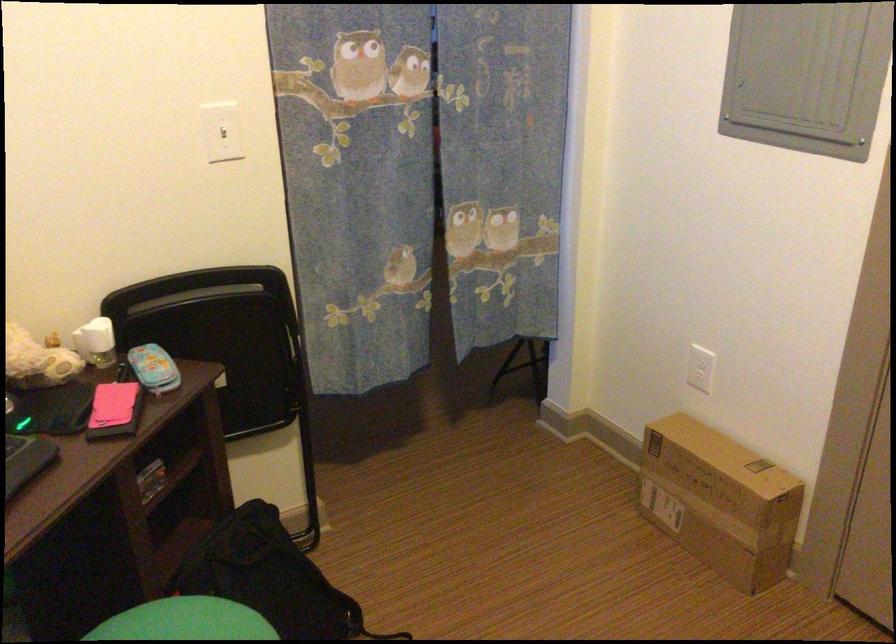
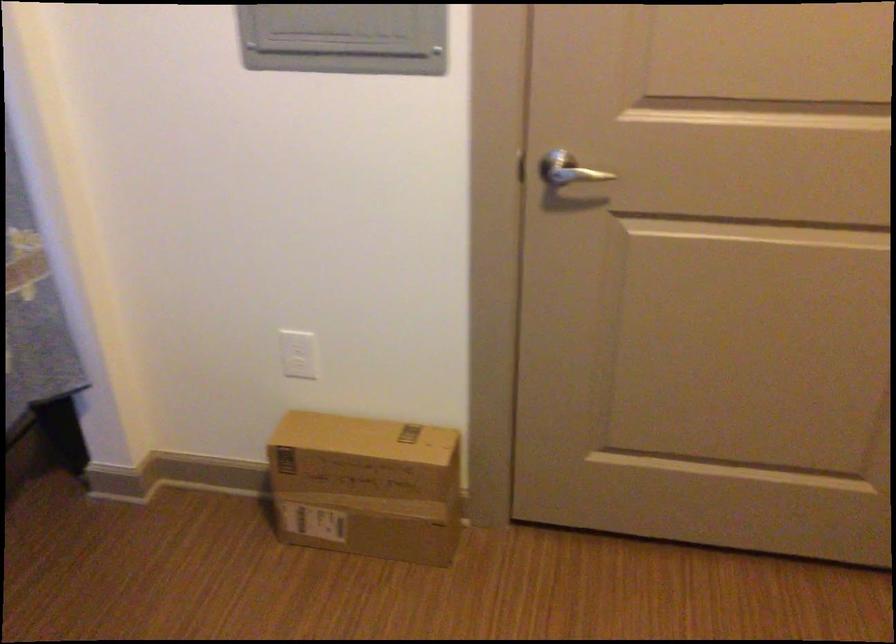
Question: The camera is either moving clockwise (left) or counter-clockwise (right) around the object. The first image is from the beginning of the video and the second image is from the end. Is the camera moving left or right when shooting the video?

Choices:
 (A) Left
 (B) Right

Answer: (A)